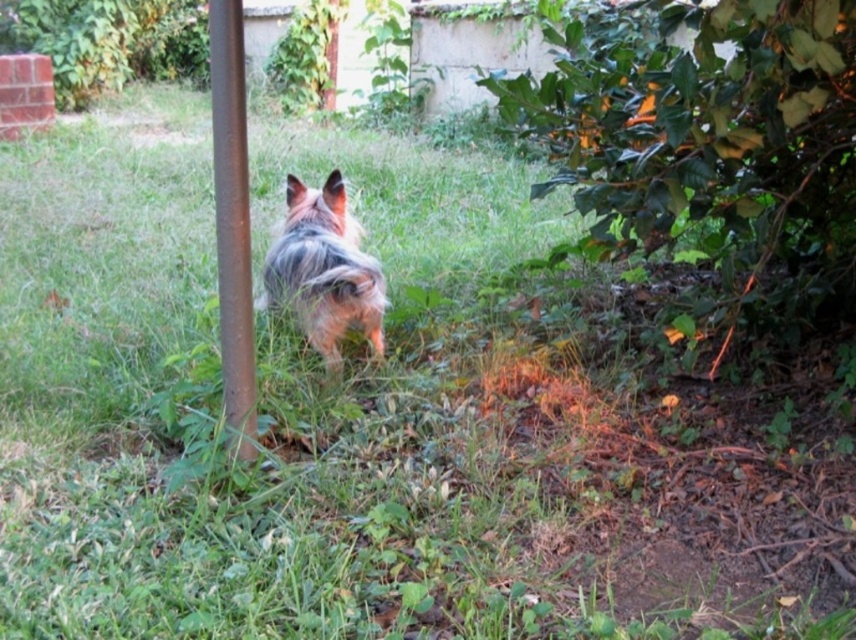
Question: Considering the relative positions of rusty metal pole at center-left and fuzzy brown dog at center in the image provided, where is rusty metal pole at center-left located with respect to fuzzy brown dog at center?

Choices:
 (A) right
 (B) left

Answer: (B)

Question: Which object appears closest to the camera in this image?

Choices:
 (A) rusty metal pole at center-left
 (B) fuzzy brown dog at center

Answer: (A)

Question: Is rusty metal pole at center-left to the right of fuzzy brown dog at center from the viewer's perspective?

Choices:
 (A) no
 (B) yes

Answer: (A)

Question: Can you confirm if rusty metal pole at center-left is positioned to the right of fuzzy brown dog at center?

Choices:
 (A) yes
 (B) no

Answer: (B)

Question: Which object is closer to the camera taking this photo?

Choices:
 (A) fuzzy brown dog at center
 (B) rusty metal pole at center-left

Answer: (B)

Question: Which object appears closest to the camera in this image?

Choices:
 (A) fuzzy brown dog at center
 (B) rusty metal pole at center-left

Answer: (B)